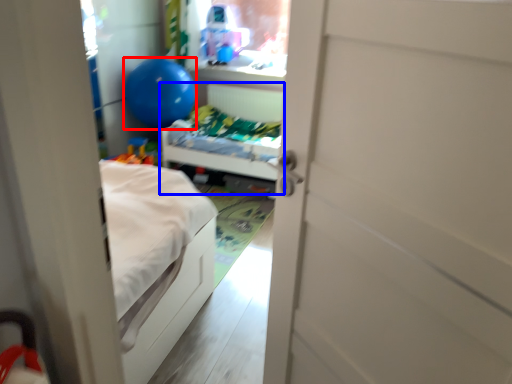
Question: Which object is further to the camera taking this photo, balloon (highlighted by a red box) or hospital bed (highlighted by a blue box)?

Choices:
 (A) balloon
 (B) hospital bed

Answer: (A)